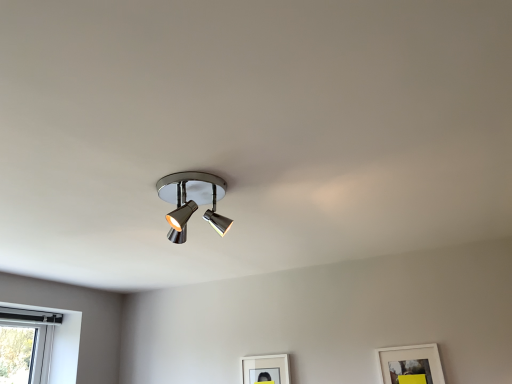
Question: Visually, is white matte picture frame at lower right, which is the 1th picture frame in right-to-left order, positioned to the left or to the right of matte white picture frame at lower center, which is the first picture frame from left to right?

Choices:
 (A) left
 (B) right

Answer: (B)

Question: Does point (397, 374) appear closer or farther from the camera than point (259, 364)?

Choices:
 (A) closer
 (B) farther

Answer: (A)

Question: Considering the real-world distances, which object is closest to the polished chrome spotlight at center?

Choices:
 (A) white matte picture frame at lower right, which is the 1th picture frame in right-to-left order
 (B) matte white picture frame at lower center, the 1th picture frame in the back-to-front sequence

Answer: (B)

Question: Based on their relative distances, which object is nearer to the matte white picture frame at lower center, the second picture frame in the front-to-back sequence?

Choices:
 (A) polished chrome spotlight at center
 (B) white matte picture frame at lower right, the first picture frame positioned from the front

Answer: (B)